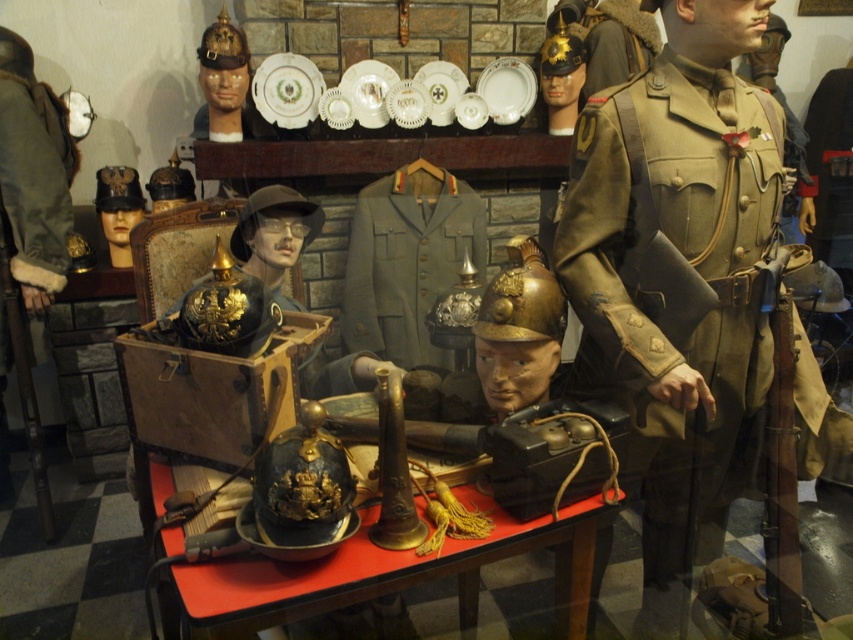
Question: Can you confirm if khaki woolen uniform at center is positioned to the right of shiny black helmet at center?

Choices:
 (A) yes
 (B) no

Answer: (A)

Question: Is the position of shiny black helmet at center less distant than that of light olive-green fabric uniform at center?

Choices:
 (A) yes
 (B) no

Answer: (A)

Question: Which of the following is the farthest from the observer?

Choices:
 (A) (683, 497)
 (B) (402, 307)

Answer: (B)

Question: Which is farther from the khaki woolen uniform at center?

Choices:
 (A) light olive-green fabric uniform at center
 (B) shiny black helmet at center

Answer: (A)

Question: Which point is farther to the camera?

Choices:
 (A) (416, 230)
 (B) (177, 532)

Answer: (A)

Question: Can you confirm if shiny black helmet at center is positioned to the right of light olive-green fabric uniform at center?

Choices:
 (A) no
 (B) yes

Answer: (A)